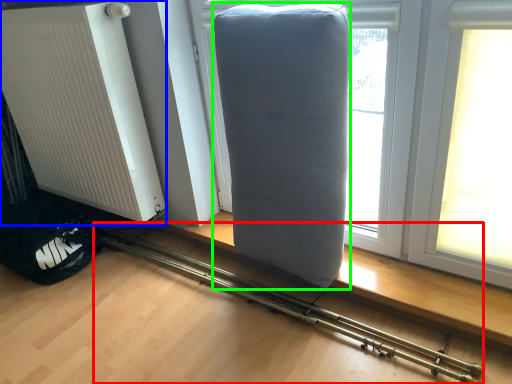
Question: Which object is the closest to the equipment (highlighted by a red box)? Choose among these: radiator (highlighted by a blue box) or furniture (highlighted by a green box).

Choices:
 (A) radiator
 (B) furniture

Answer: (B)